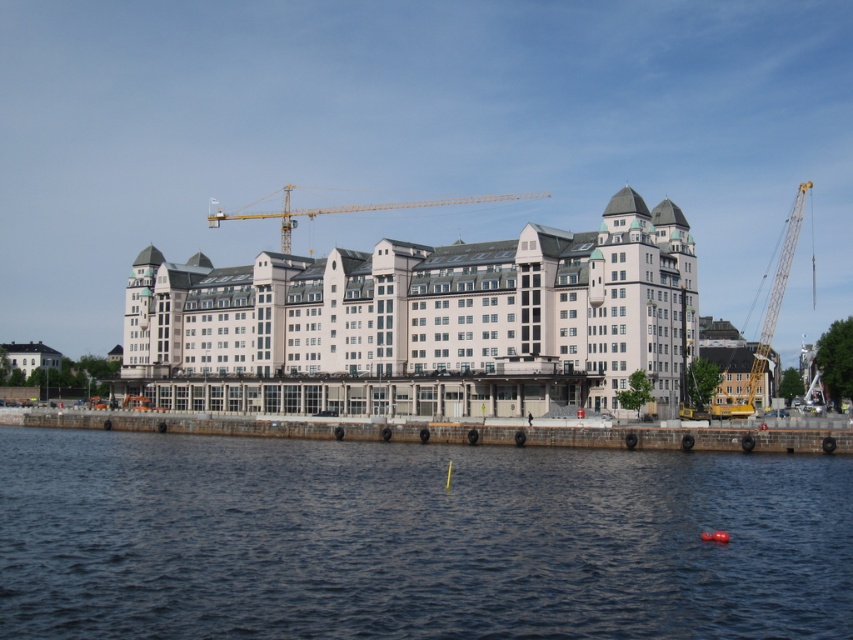
Is dark blue water at lower center to the right of yellow metallic crane at center from the viewer's perspective?

Yes, dark blue water at lower center is to the right of yellow metallic crane at center.

Is dark blue water at lower center to the left of yellow metallic crane at center from the viewer's perspective?

In fact, dark blue water at lower center is to the right of yellow metallic crane at center.

This screenshot has height=640, width=853. Identify the location of dark blue water at lower center. (413, 540).

Is point (350, 260) positioned in front of point (314, 211)?

That is True.

Between point (273, 412) and point (415, 202), which one is positioned in front?

Point (273, 412)

Identify the location of white smooth building at center. (426, 323).

Is white smooth building at center below yellow metallic crane at right?

No.

Is point (474, 257) less distant than point (798, 189)?

Yes, point (474, 257) is in front of point (798, 189).

The image size is (853, 640). In order to click on white smooth building at center in this screenshot , I will do `click(426, 323)`.